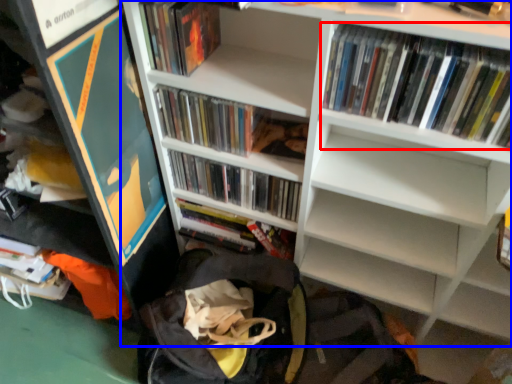
Question: Which point is closer to the camera, book (highlighted by a red box) or bookcase (highlighted by a blue box)?

Choices:
 (A) book
 (B) bookcase

Answer: (B)